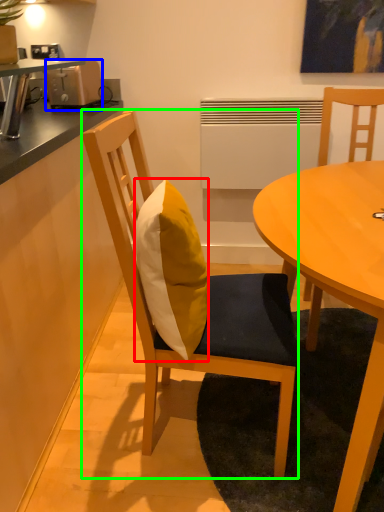
Question: Based on their relative distances, which object is farther from pillow (highlighted by a red box)? Choose from toaster (highlighted by a blue box) and chair (highlighted by a green box).

Choices:
 (A) toaster
 (B) chair

Answer: (A)